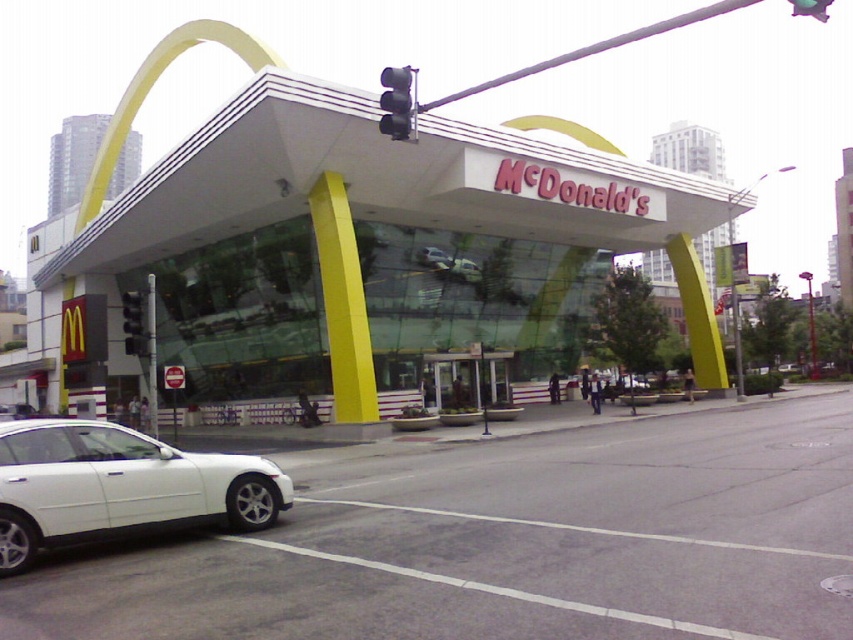
Which is more to the right, white glossy car at lower left or black plastic traffic light at left?

white glossy car at lower left is more to the right.

Can you confirm if white glossy car at lower left is thinner than black plastic traffic light at left?

In fact, white glossy car at lower left might be wider than black plastic traffic light at left.

Locate an element on the screen. The width and height of the screenshot is (853, 640). white glossy car at lower left is located at coordinates (506, 545).

Locate an element on the screen. The height and width of the screenshot is (640, 853). white glossy car at lower left is located at coordinates (506, 545).

In the scene shown: Can you confirm if white glossy car at lower left is positioned above metallic silver car at center?

No, white glossy car at lower left is not above metallic silver car at center.

The height and width of the screenshot is (640, 853). What do you see at coordinates (506, 545) in the screenshot?
I see `white glossy car at lower left` at bounding box center [506, 545].

Identify the location of white glossy car at lower left. The height and width of the screenshot is (640, 853). (506, 545).

Does matte yellow mcdonald's at center have a lesser width compared to metallic silver car at center?

No.

What do you see at coordinates (381, 252) in the screenshot?
I see `matte yellow mcdonald's at center` at bounding box center [381, 252].

Is point (212, 365) in front of point (451, 262)?

No, (212, 365) is behind (451, 262).

Locate an element on the screen. matte yellow mcdonald's at center is located at coordinates (381, 252).